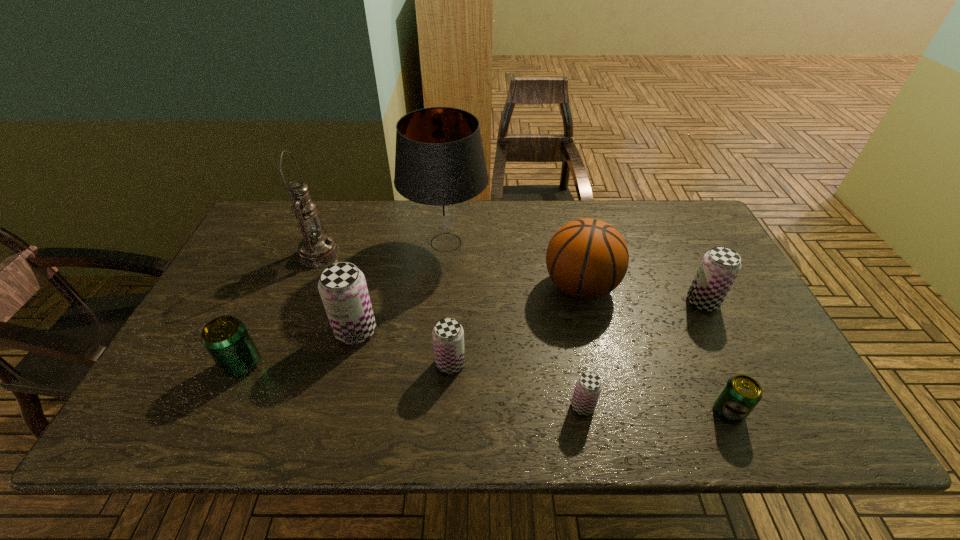
Identify the location of vacant space that's between the gray lampshade and the fourth beer can from right to left. The image size is (960, 540). (448, 303).

Where is `object that is the second nearest to the basketball`? object that is the second nearest to the basketball is located at coordinates (720, 266).

I want to click on the eighth closest object to the rightmost purple beer can, so click(226, 339).

Locate an element on the screen. This screenshot has width=960, height=540. the sixth closest beer can to the oil lamp is located at coordinates (741, 393).

Where is `the fourth closest beer can to the leftmost purple beer can`? The image size is (960, 540). the fourth closest beer can to the leftmost purple beer can is located at coordinates (741, 393).

Identify the location of purple beer can identified as the third closest to the second purple beer can from right to left. (342, 286).

Locate which purple beer can is the fourth closest to the gray lampshade. Please provide its 2D coordinates. Your answer should be formatted as a tuple, i.e. [(x, y)], where the tuple contains the x and y coordinates of a point satisfying the conditions above.

[(720, 266)]

Where is `free space that satisfies the following two spatial constraints: 1. on the front side of the second nearest purple beer can; 2. on the left side of the smallest purple beer can`? Image resolution: width=960 pixels, height=540 pixels. free space that satisfies the following two spatial constraints: 1. on the front side of the second nearest purple beer can; 2. on the left side of the smallest purple beer can is located at coordinates (448, 406).

The height and width of the screenshot is (540, 960). I want to click on vacant area in the image that satisfies the following two spatial constraints: 1. on the back side of the left green beer can; 2. on the left side of the second smallest purple beer can, so pos(243,363).